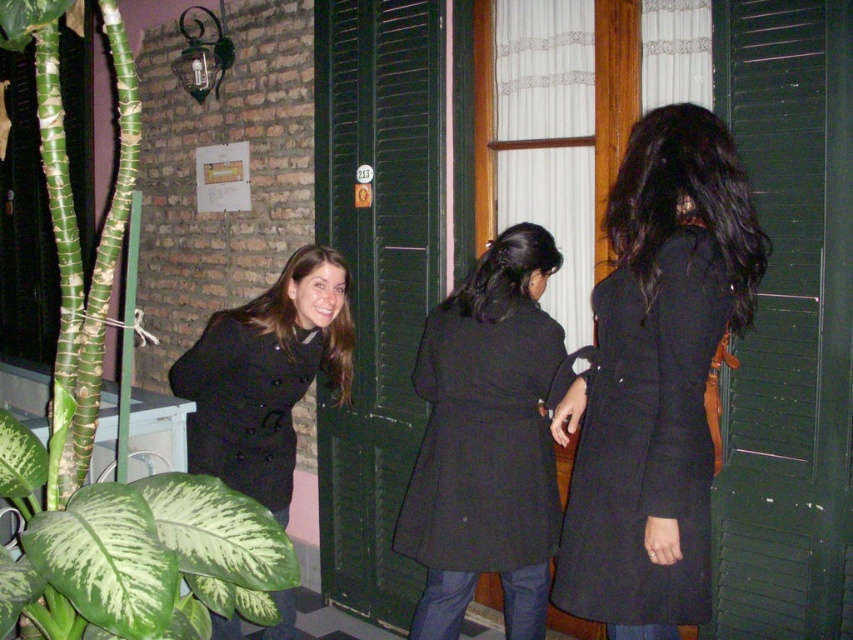
You are a fashion designer observing the scene. You notice two coats, the matte black coat at center and the smooth black coat at center. Which one is taller?

The matte black coat at center is taller than the smooth black coat at center.

You are a delivery person trying to reach a doorbell located at the bottom of the green wooden shutters. The green leafy plant at left and the black matte coat at center are blocking your path. Which object should you move to access the doorbell more easily?

The green leafy plant at left is taller than the black matte coat at center, so you should move the green leafy plant at left to access the doorbell more easily.

You are standing at the point marked as point (94, 429). What object is located at this point?

The green leafy plant at left is located at point (94, 429).